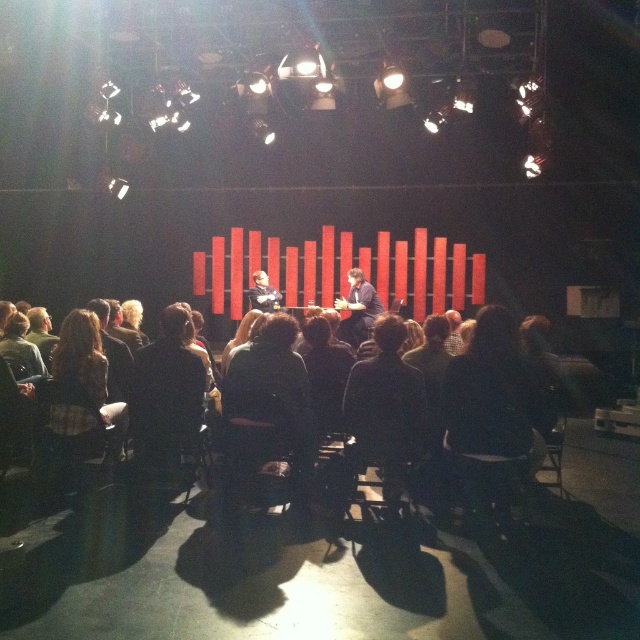
Question: Which object is the closest to the black fabric chair at lower left?

Choices:
 (A) smooth black jacket at center
 (B) black fabric chair at lower center
 (C) dark brown hair at center
 (D) dark brown leather jacket at center

Answer: (C)

Question: Considering the real-world distances, which object is closest to the smooth black jacket at center?

Choices:
 (A) black fabric chair at lower left
 (B) black plastic chair at center

Answer: (A)

Question: Can you confirm if black fabric chair at lower center is positioned to the right of black fabric chair at lower left?

Choices:
 (A) yes
 (B) no

Answer: (A)

Question: Which of the following is the farthest from the observer?

Choices:
 (A) (540, 452)
 (B) (554, 428)
 (C) (362, 332)
 (D) (394, 477)

Answer: (C)

Question: Does black fabric chair at lower left have a larger size compared to matte black chair at center?

Choices:
 (A) yes
 (B) no

Answer: (B)

Question: Is black fabric chair at lower center further to camera compared to black fabric chair at lower left?

Choices:
 (A) no
 (B) yes

Answer: (A)